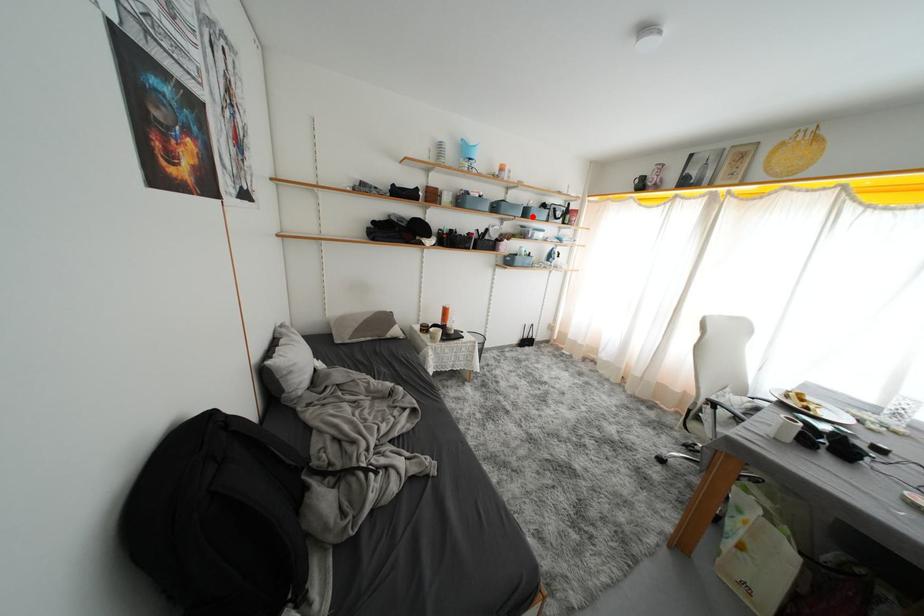
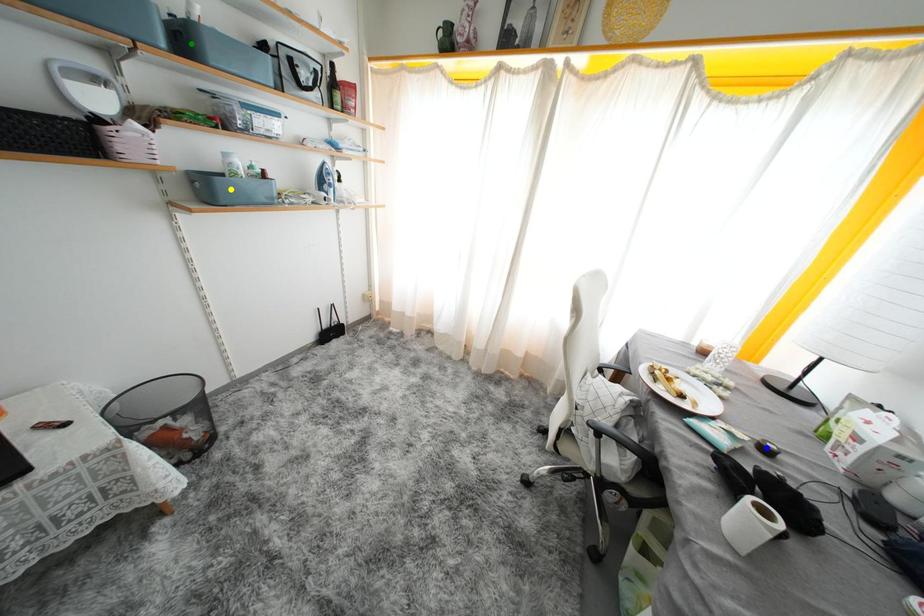
Question: I am providing you with two images of the same scene from different viewpoints. A red point is marked on the first image. You are given multiple points on the second image. In image 2, which mark is for the same physical point as the one in image 1?

Choices:
 (A) green point
 (B) yellow point
 (C) blue point

Answer: (A)